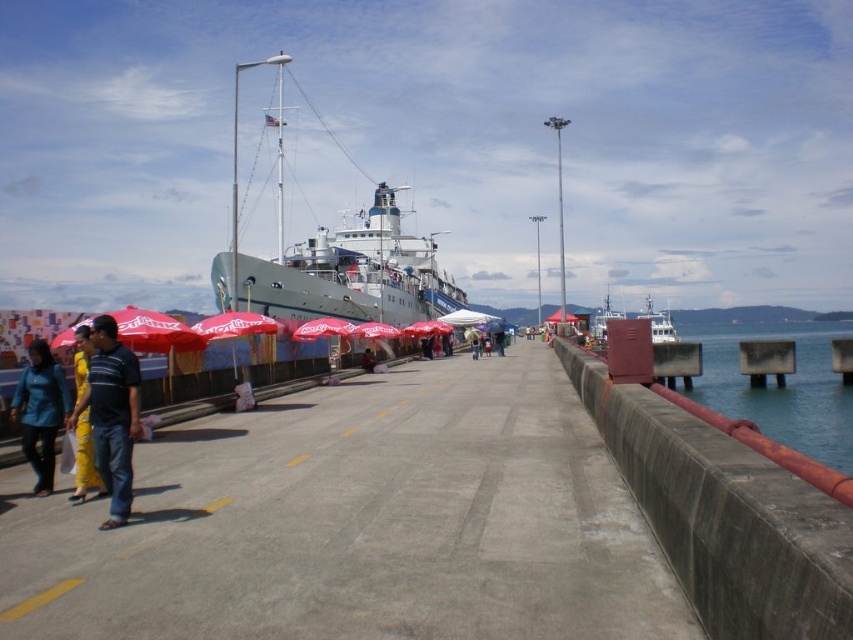
You are a photographer standing at the striped fabric shirt at center location. You want to take a photo of the red fabric umbrella at center. Considering your camera can focus up to 20 meters, will you be able to capture the umbrella clearly?

The distance between the striped fabric shirt at center and the red fabric umbrella at center is 22.17 meters. Since your camera can only focus up to 20 meters, you won

You are standing on the concrete walkway and notice a striped fabric shirt at center. Where exactly is the striped fabric shirt located in relation to the red umbrellas on the left side of the walkway?

The striped fabric shirt at center is located at point (111, 413), which is to the right of the red umbrellas on the left side of the walkway.

You are a photographer standing at the camera position. You want to capture a photo of the metallic gray boat at right. Considering your camera has a maximum focus range of 30 feet, will you be able to focus on the boat clearly?

The metallic gray boat at right is 32.71 feet away from the camera, which exceeds the maximum focus range of 30 feet. Therefore, the camera will not be able to focus on the boat clearly.